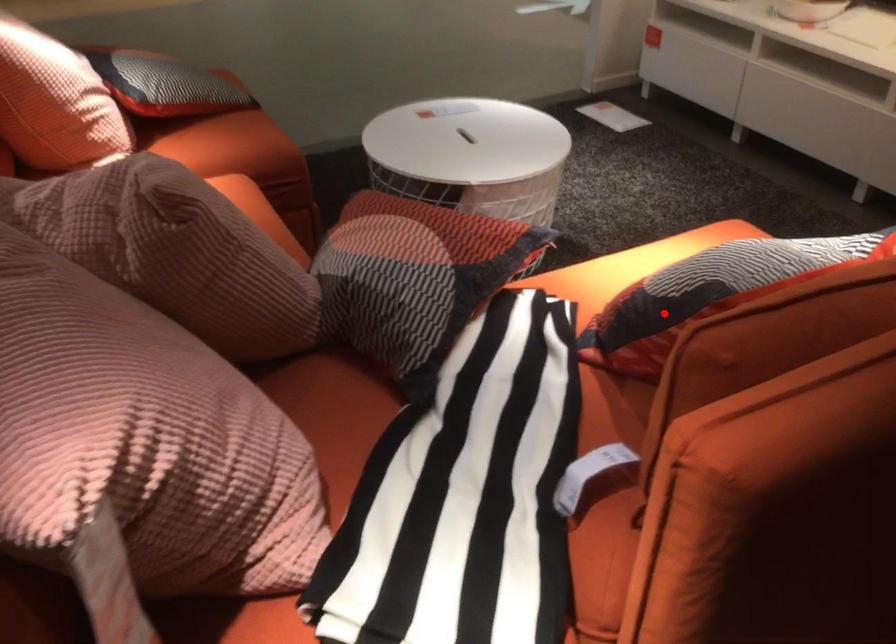
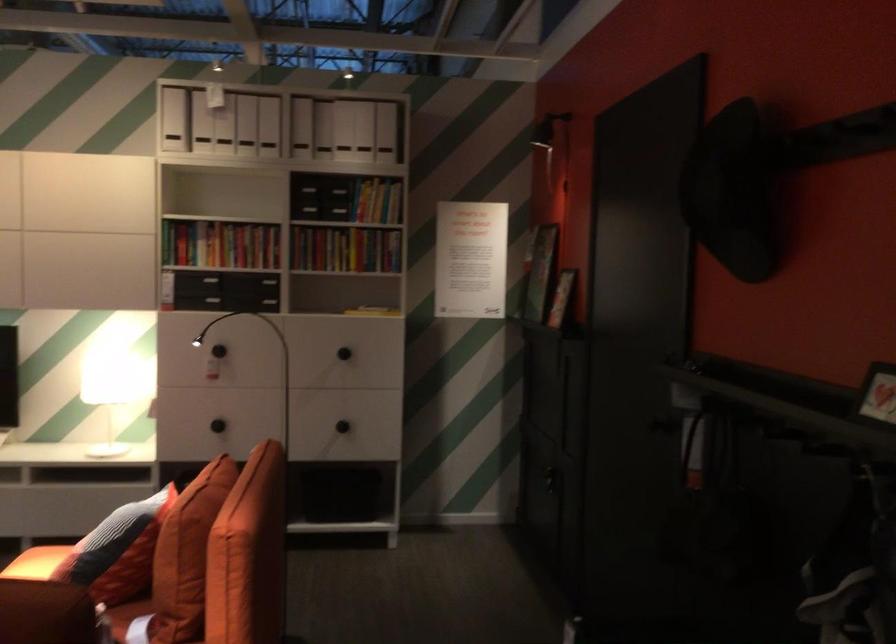
Where in the second image is the point corresponding to the highlighted location from the first image?

(117, 551)